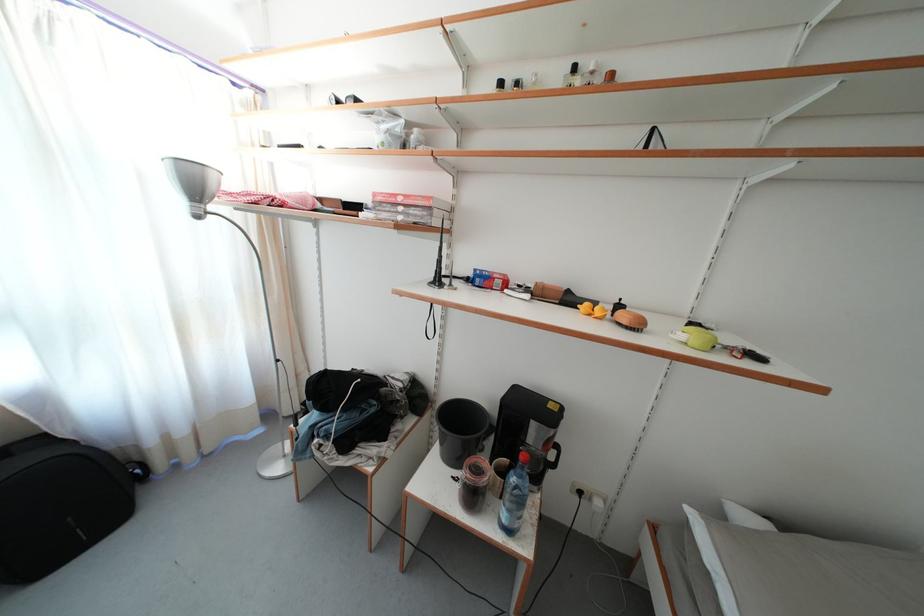
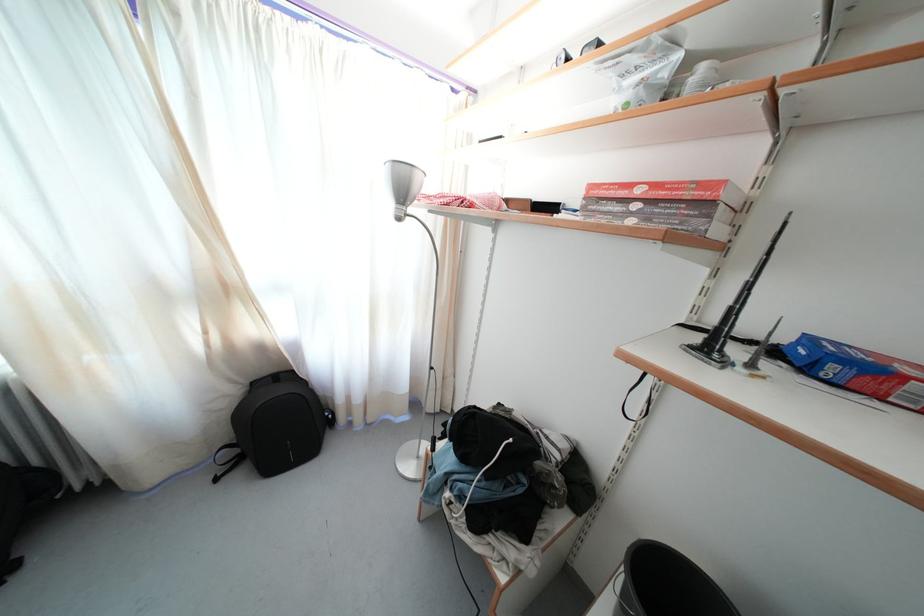
In the second image, find the point that corresponds to point (441, 290) in the first image.

(714, 361)